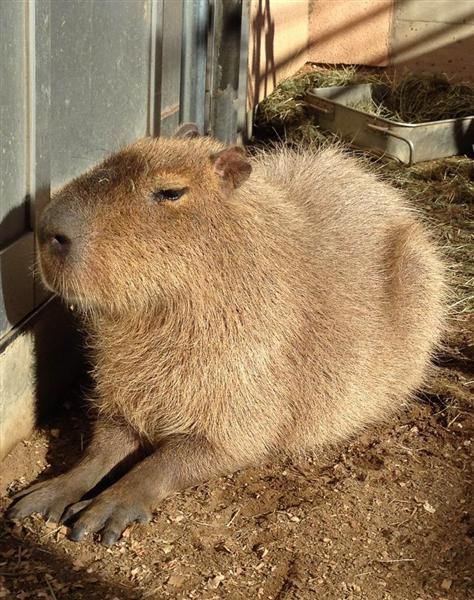
Find the location of a particular element. The image size is (474, 600). right front leg is located at coordinates (95, 467).